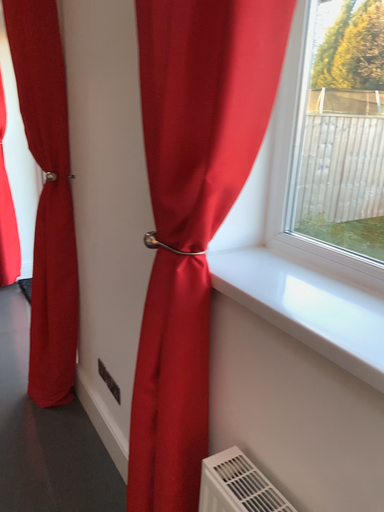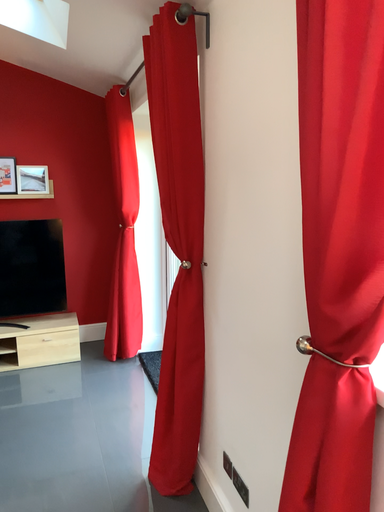
Question: Which way did the camera rotate in the video?

Choices:
 (A) rotated right
 (B) rotated left

Answer: (B)